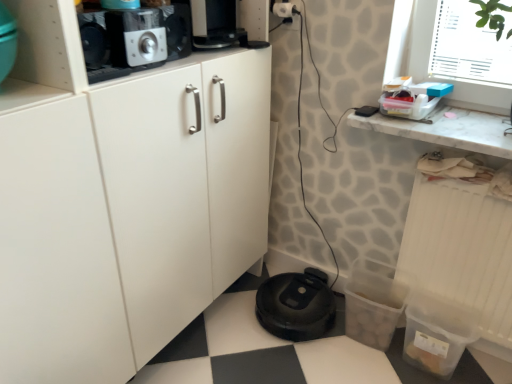
Question: Does white plastic window screen at upper right have a lesser height compared to black plastic robot vacuum cleaner at lower center?

Choices:
 (A) no
 (B) yes

Answer: (A)

Question: Is white plastic window screen at upper right thinner than black plastic robot vacuum cleaner at lower center?

Choices:
 (A) no
 (B) yes

Answer: (B)

Question: Is there a large distance between white plastic window screen at upper right and black plastic robot vacuum cleaner at lower center?

Choices:
 (A) no
 (B) yes

Answer: (B)

Question: Is white plastic window screen at upper right to the left of black plastic robot vacuum cleaner at lower center from the viewer's perspective?

Choices:
 (A) no
 (B) yes

Answer: (A)

Question: From a real-world perspective, is white plastic window screen at upper right beneath black plastic robot vacuum cleaner at lower center?

Choices:
 (A) no
 (B) yes

Answer: (A)

Question: Could you tell me if white plastic window screen at upper right is facing black plastic robot vacuum cleaner at lower center?

Choices:
 (A) no
 (B) yes

Answer: (A)

Question: Does white marble countertop at upper right have a greater height compared to brushed metal toaster at upper left?

Choices:
 (A) no
 (B) yes

Answer: (A)

Question: From a real-world perspective, is white marble countertop at upper right under brushed metal toaster at upper left?

Choices:
 (A) no
 (B) yes

Answer: (B)

Question: Is white marble countertop at upper right looking in the opposite direction of brushed metal toaster at upper left?

Choices:
 (A) no
 (B) yes

Answer: (A)

Question: Does white marble countertop at upper right turn towards brushed metal toaster at upper left?

Choices:
 (A) yes
 (B) no

Answer: (B)

Question: Would you say white marble countertop at upper right is a long distance from brushed metal toaster at upper left?

Choices:
 (A) yes
 (B) no

Answer: (B)

Question: Is the position of white marble countertop at upper right less distant than that of brushed metal toaster at upper left?

Choices:
 (A) no
 (B) yes

Answer: (A)

Question: Considering the relative positions of white plastic window screen at upper right and white plastic electric outlet at upper right in the image provided, is white plastic window screen at upper right behind white plastic electric outlet at upper right?

Choices:
 (A) yes
 (B) no

Answer: (B)